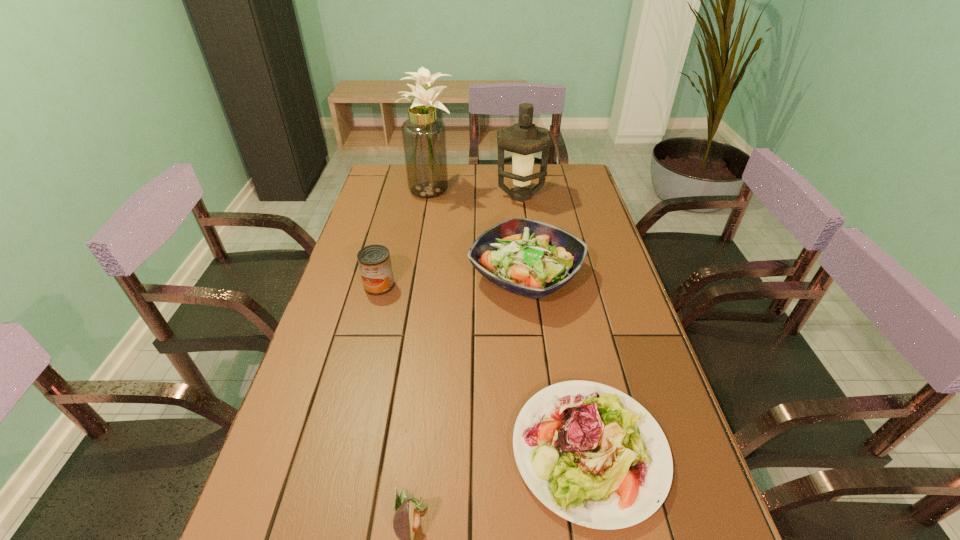
I want to click on vacant space that's between the can and the taller salad plate, so click(453, 280).

Where is `free area in between the oil lamp and the flower arrangement`? Image resolution: width=960 pixels, height=540 pixels. free area in between the oil lamp and the flower arrangement is located at coordinates [475, 193].

Find the location of a particular element. unoccupied area between the farther salad plate and the flower arrangement is located at coordinates (478, 233).

At what (x,y) coordinates should I click in order to perform the action: click on vacant space that is in between the farther salad plate and the shortest object. Please return your answer as a coordinate pair (x, y). The image size is (960, 540). Looking at the image, I should click on (558, 362).

Identify the location of free space between the nearer salad plate and the can. This screenshot has height=540, width=960. click(x=485, y=368).

Where is `free point between the second tallest object and the can`? Image resolution: width=960 pixels, height=540 pixels. free point between the second tallest object and the can is located at coordinates (450, 241).

What are the coordinates of `the closest object relative to the can` in the screenshot? It's located at (527, 257).

Locate which object is the third closest to the taller salad plate. Please provide its 2D coordinates. Your answer should be formatted as a tuple, i.e. [(x, y)], where the tuple contains the x and y coordinates of a point satisfying the conditions above.

[(612, 468)]